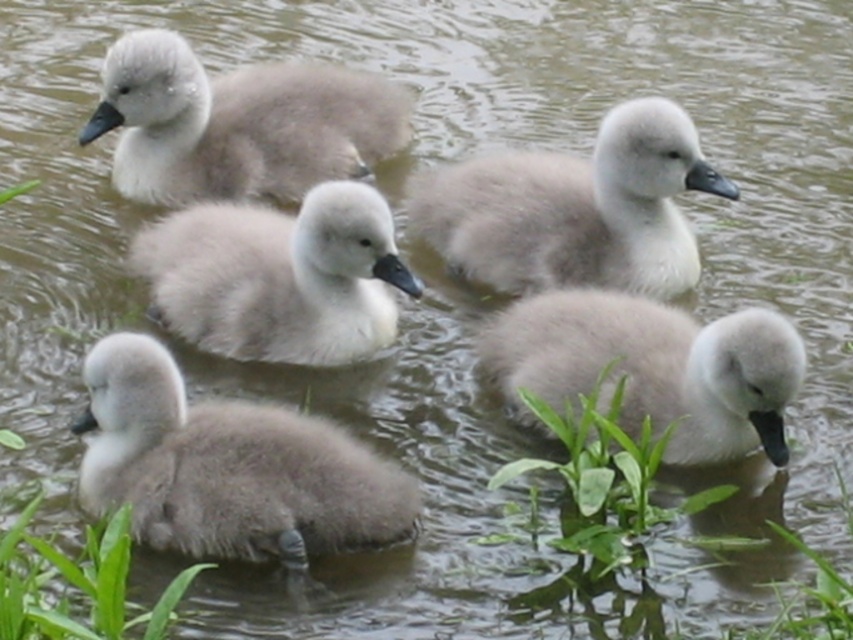
Question: Is gray fluffy swan at center below gray fluffy swan at upper left?

Choices:
 (A) no
 (B) yes

Answer: (B)

Question: Does gray fluffy swan at lower right appear on the left side of green leafy grass at lower left?

Choices:
 (A) yes
 (B) no

Answer: (B)

Question: Which point appears farthest from the camera in this image?

Choices:
 (A) (252, 140)
 (B) (692, 362)

Answer: (A)

Question: Estimate the real-world distances between objects in this image. Which object is farther from the fluffy gray swan at center?

Choices:
 (A) gray fluffy swan at lower right
 (B) gray fluffy swan at lower left
 (C) gray fluffy swan at upper left

Answer: (B)

Question: Which object appears farthest from the camera in this image?

Choices:
 (A) gray fluffy swan at center
 (B) gray fluffy swan at upper left
 (C) green leafy grass at lower left

Answer: (B)

Question: Can you confirm if gray fluffy swan at center is thinner than gray fluffy swan at upper left?

Choices:
 (A) no
 (B) yes

Answer: (B)